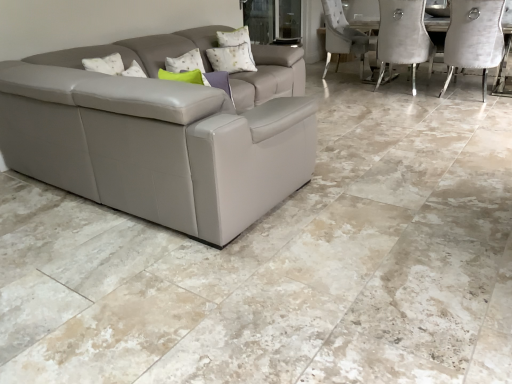
Question: Considering the relative sizes of white textured pillow at upper center and velvet grey chair at upper right in the image provided, is white textured pillow at upper center shorter than velvet grey chair at upper right?

Choices:
 (A) no
 (B) yes

Answer: (B)

Question: Is white textured pillow at upper center not within velvet grey chair at upper right?

Choices:
 (A) yes
 (B) no

Answer: (A)

Question: Is white textured pillow at upper center taller than velvet grey chair at upper right?

Choices:
 (A) no
 (B) yes

Answer: (A)

Question: Can you confirm if white textured pillow at upper center is wider than velvet grey chair at upper right?

Choices:
 (A) yes
 (B) no

Answer: (B)

Question: Considering the relative positions of white textured pillow at upper center and velvet grey chair at upper right in the image provided, is white textured pillow at upper center to the right of velvet grey chair at upper right from the viewer's perspective?

Choices:
 (A) yes
 (B) no

Answer: (B)

Question: In the image, is velvet grey chair at upper right positioned in front of or behind white textured pillow at upper center?

Choices:
 (A) behind
 (B) front

Answer: (B)

Question: From a real-world perspective, is velvet grey chair at upper right positioned above or below white textured pillow at upper center?

Choices:
 (A) above
 (B) below

Answer: (B)

Question: Does point (475, 1) appear closer or farther from the camera than point (247, 38)?

Choices:
 (A) closer
 (B) farther

Answer: (A)

Question: From the image's perspective, is velvet grey chair at upper right located above or below white textured pillow at upper center?

Choices:
 (A) above
 (B) below

Answer: (A)

Question: From the image's perspective, is transparent glass door at upper center located above or below velvet grey chair at upper right?

Choices:
 (A) above
 (B) below

Answer: (A)

Question: In the image, is transparent glass door at upper center on the left side or the right side of velvet grey chair at upper right?

Choices:
 (A) right
 (B) left

Answer: (B)

Question: Considering the positions of transparent glass door at upper center and velvet grey chair at upper right in the image, is transparent glass door at upper center taller or shorter than velvet grey chair at upper right?

Choices:
 (A) short
 (B) tall

Answer: (A)

Question: Choose the correct answer: Is transparent glass door at upper center inside velvet grey chair at upper right or outside it?

Choices:
 (A) inside
 (B) outside

Answer: (B)

Question: From the image's perspective, is white textured pillow at upper center above or below transparent glass door at upper center?

Choices:
 (A) above
 (B) below

Answer: (B)

Question: From a real-world perspective, is white textured pillow at upper center physically located above or below transparent glass door at upper center?

Choices:
 (A) above
 (B) below

Answer: (A)